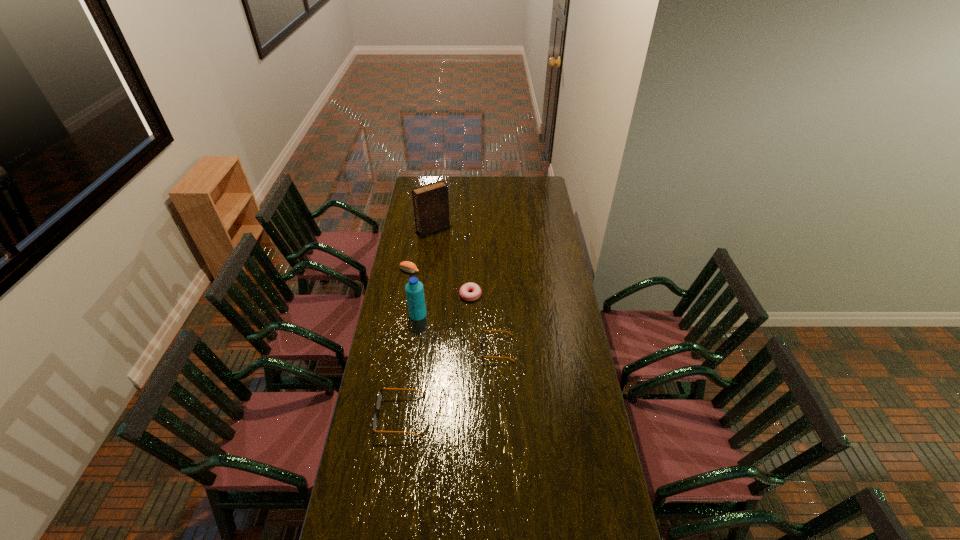
Locate an element on the screen. The image size is (960, 540). blank space located 0.250m on the front-facing side of the right spectacles is located at coordinates (423, 348).

The image size is (960, 540). Find the location of `vacant space located 0.160m on the front-facing side of the right spectacles`. vacant space located 0.160m on the front-facing side of the right spectacles is located at coordinates (444, 348).

Image resolution: width=960 pixels, height=540 pixels. What are the coordinates of `free space located on the front-facing side of the right spectacles` in the screenshot? It's located at (412, 348).

Find the location of a particular element. Image resolution: width=960 pixels, height=540 pixels. vacant region located on the front of the doughnut is located at coordinates (468, 366).

This screenshot has height=540, width=960. Identify the location of free space located 0.290m on the front of the Bible. (428, 270).

I want to click on free region located on the right of the water bottle, so click(485, 314).

Where is `vacant region located on the right of the second farthest object`? vacant region located on the right of the second farthest object is located at coordinates (459, 271).

What are the coordinates of `spectacles that is at the left edge` in the screenshot? It's located at (379, 397).

Where is `Bible that is positioned at the left edge`? The width and height of the screenshot is (960, 540). Bible that is positioned at the left edge is located at coordinates (431, 202).

I want to click on water bottle located at the left edge, so click(x=414, y=289).